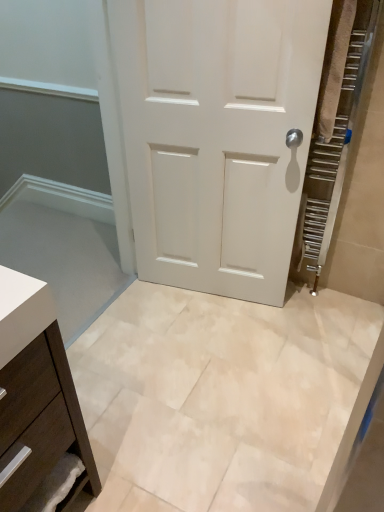
Question: Can you confirm if matte brown drawer at lower left is positioned to the left of beige marble tile at center?

Choices:
 (A) no
 (B) yes

Answer: (B)

Question: Is beige marble tile at center at the back of matte brown drawer at lower left?

Choices:
 (A) yes
 (B) no

Answer: (B)

Question: Are matte brown drawer at lower left and beige marble tile at center far apart?

Choices:
 (A) no
 (B) yes

Answer: (A)

Question: From a real-world perspective, does matte brown drawer at lower left sit lower than beige marble tile at center?

Choices:
 (A) no
 (B) yes

Answer: (A)

Question: From the image's perspective, is matte brown drawer at lower left on top of beige marble tile at center?

Choices:
 (A) yes
 (B) no

Answer: (B)

Question: Is point (286, 65) closer or farther from the camera than point (34, 457)?

Choices:
 (A) closer
 (B) farther

Answer: (B)

Question: Considering the positions of white matte door at center and matte brown drawer at lower left in the image, is white matte door at center taller or shorter than matte brown drawer at lower left?

Choices:
 (A) tall
 (B) short

Answer: (A)

Question: Looking at their shapes, would you say white matte door at center is wider or thinner than matte brown drawer at lower left?

Choices:
 (A) thin
 (B) wide

Answer: (A)

Question: Is white matte door at center to the left or to the right of matte brown drawer at lower left in the image?

Choices:
 (A) left
 (B) right

Answer: (B)

Question: Is white matte door at center taller or shorter than beige marble tile at center?

Choices:
 (A) tall
 (B) short

Answer: (A)

Question: Would you say white matte door at center is to the left or to the right of beige marble tile at center in the picture?

Choices:
 (A) left
 (B) right

Answer: (B)

Question: Is white matte door at center bigger or smaller than beige marble tile at center?

Choices:
 (A) big
 (B) small

Answer: (A)

Question: From the image's perspective, is white matte door at center above or below beige marble tile at center?

Choices:
 (A) below
 (B) above

Answer: (B)

Question: From their relative heights in the image, would you say beige marble tile at center is taller or shorter than white matte door at center?

Choices:
 (A) tall
 (B) short

Answer: (B)

Question: From the image's perspective, is beige marble tile at center located above or below white matte door at center?

Choices:
 (A) below
 (B) above

Answer: (A)